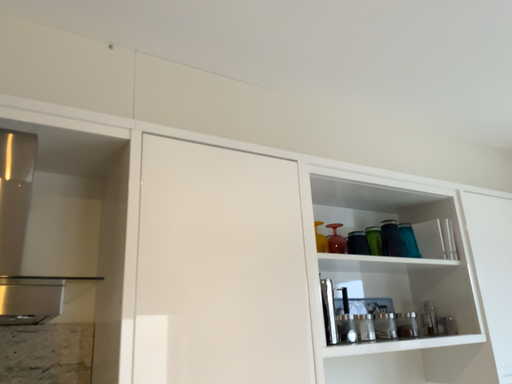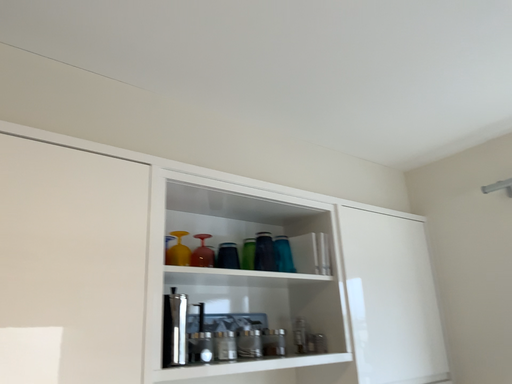
Question: Which way did the camera rotate in the video?

Choices:
 (A) rotated left
 (B) rotated right

Answer: (B)